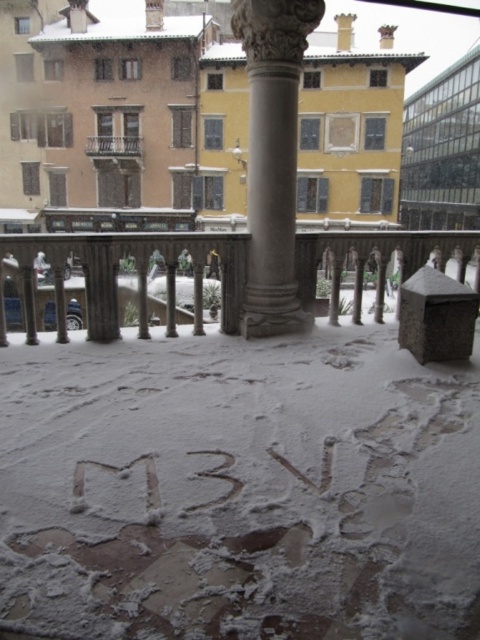
Between smooth gray railing at center and metallic balcony at upper center, which one has less height?

Standing shorter between the two is metallic balcony at upper center.

Between smooth gray railing at center and metallic balcony at upper center, which one is positioned higher?

metallic balcony at upper center

Locate an element on the screen. smooth gray railing at center is located at coordinates (220, 275).

Which is in front, point (322, 253) or point (286, 301)?

Point (286, 301) is more forward.

Can you confirm if smooth gray railing at center is bigger than polished stone column at center?

Yes.

Does point (343, 241) come in front of point (263, 90)?

No, it is not.

The image size is (480, 640). What are the coordinates of `smooth gray railing at center` in the screenshot? It's located at (220, 275).

Is point (263, 316) less distant than point (139, 166)?

Yes, it is in front of point (139, 166).

What do you see at coordinates (273, 157) in the screenshot?
I see `polished stone column at center` at bounding box center [273, 157].

The image size is (480, 640). Identify the location of polished stone column at center. (273, 157).